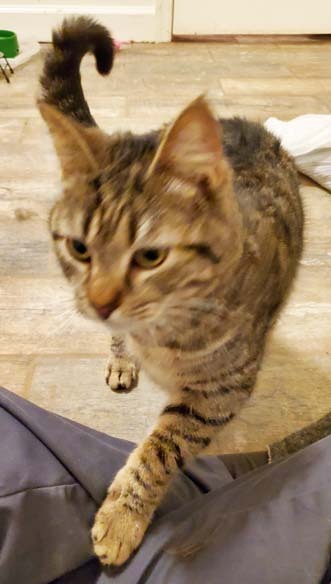
You are a GUI agent. You are given a task and a screenshot of the screen. Output one action in this format:
    pyautogui.click(x=<x>, y=<y>)
    Task: Click on the door
    Image resolution: width=331 pixels, height=584 pixels.
    Given the screenshot: What is the action you would take?
    pyautogui.click(x=253, y=13)